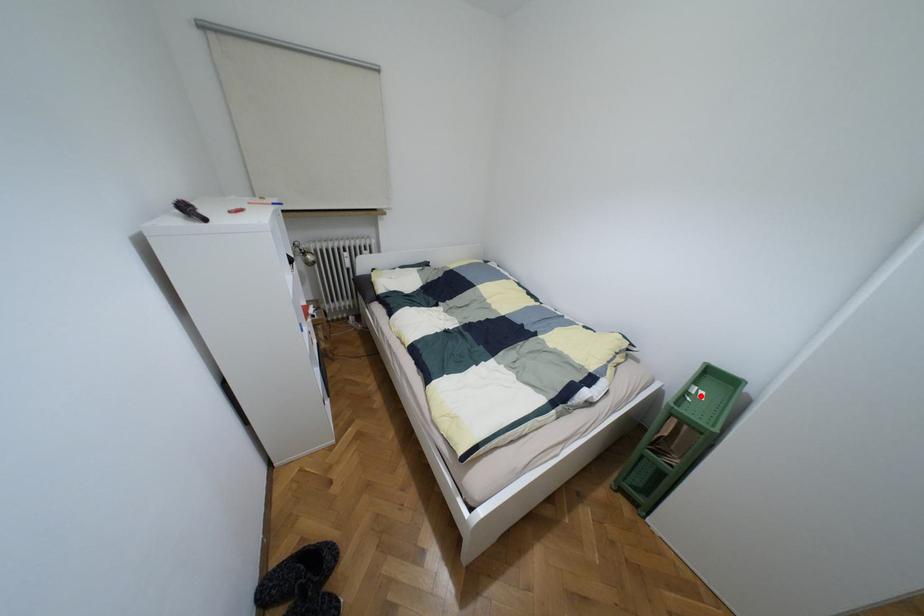
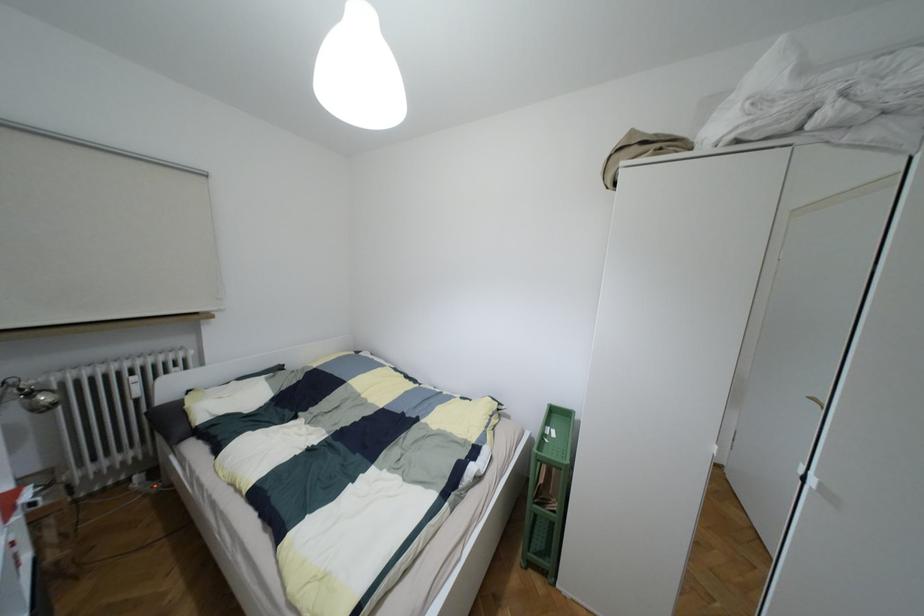
Question: I am providing you with two images of the same scene from different viewpoints. In image1, a red point is highlighted. Considering the same 3D point in image2, which of the following is correct?

Choices:
 (A) It is closer
 (B) It is farther

Answer: (A)